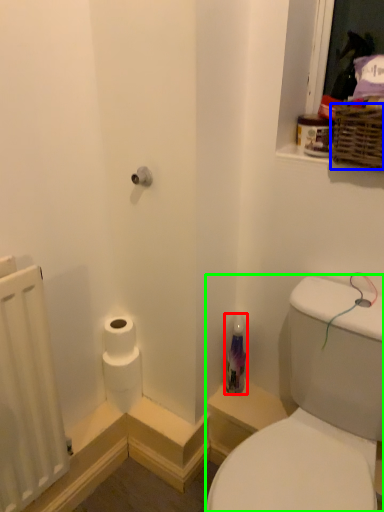
Question: Which object is the farthest from toiletry (highlighted by a red box)? Choose among these: basket (highlighted by a blue box) or sink (highlighted by a green box).

Choices:
 (A) basket
 (B) sink

Answer: (A)